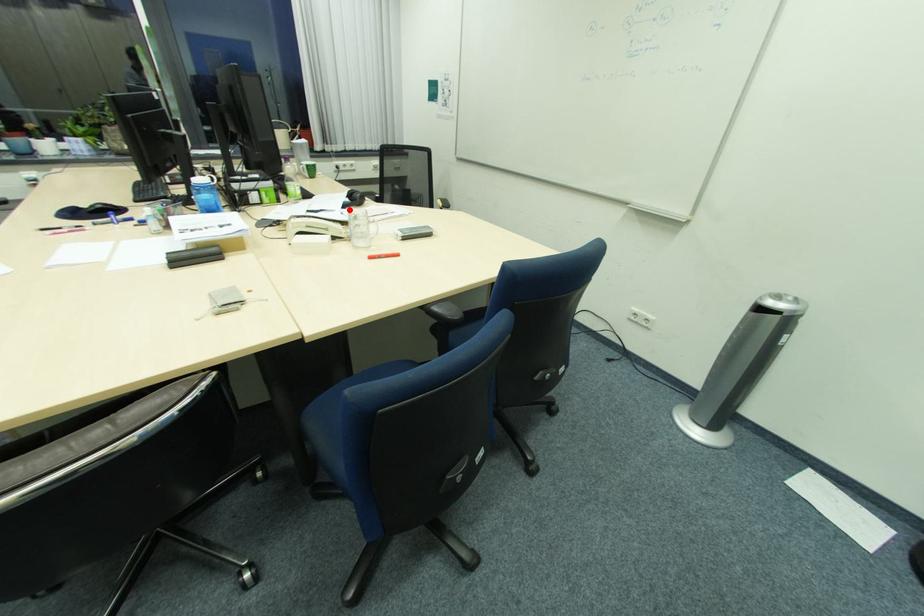
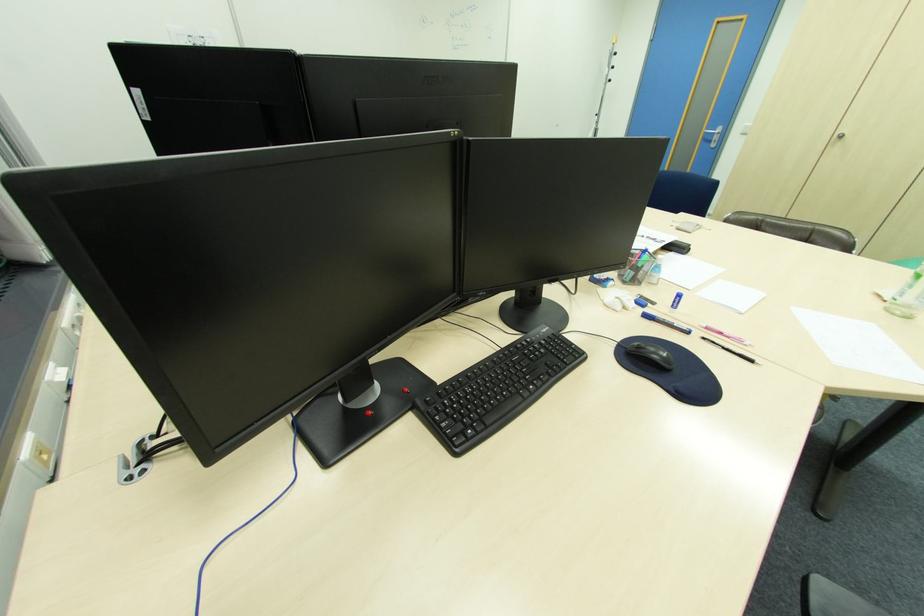
Question: I am providing you with two images of the same scene from different viewpoints. A red point is marked on the first image. Can you still see the location of the red point in image 2?

Choices:
 (A) Yes
 (B) No

Answer: (B)